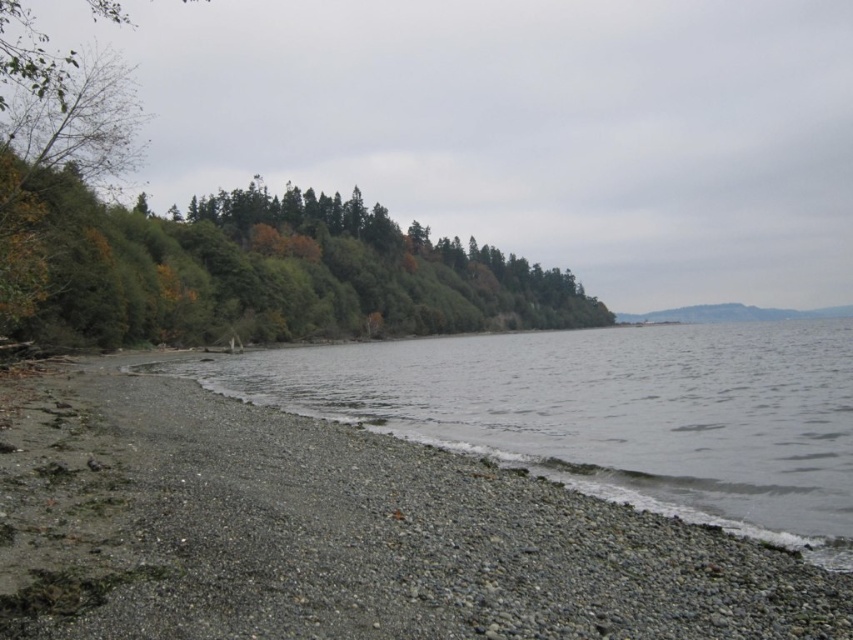
Is point (762, 412) behind point (448, 305)?

No, (762, 412) is closer to viewer.

Which is in front, point (782, 333) or point (471, 288)?

Positioned in front is point (782, 333).

Where is `gray gravelly water at lower left`? Image resolution: width=853 pixels, height=640 pixels. gray gravelly water at lower left is located at coordinates (608, 412).